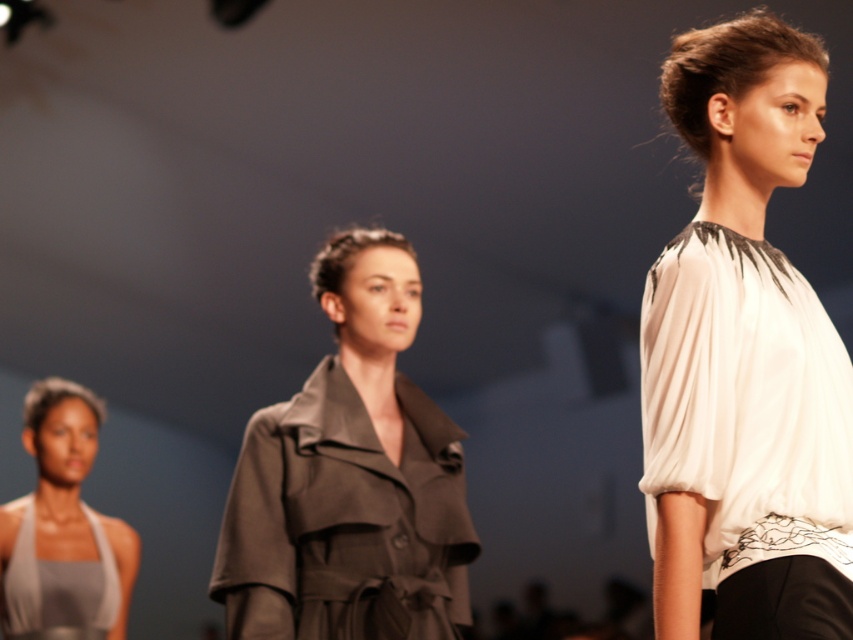
Question: From the image, what is the correct spatial relationship of white silk blouse at right in relation to matte brown coat at center?

Choices:
 (A) right
 (B) left

Answer: (A)

Question: Which of the following is the farthest from the observer?

Choices:
 (A) (277, 480)
 (B) (680, 577)
 (C) (85, 444)

Answer: (C)

Question: Which of the following is the closest to the observer?

Choices:
 (A) (467, 536)
 (B) (96, 618)

Answer: (A)

Question: Is white silk blouse at right positioned in front of matte brown coat at center?

Choices:
 (A) no
 (B) yes

Answer: (B)

Question: Which of these objects is positioned closest to the matte brown coat at center?

Choices:
 (A) white silk blouse at right
 (B) matte gray halter top at lower left

Answer: (A)

Question: Is white silk blouse at right behind matte brown coat at center?

Choices:
 (A) no
 (B) yes

Answer: (A)